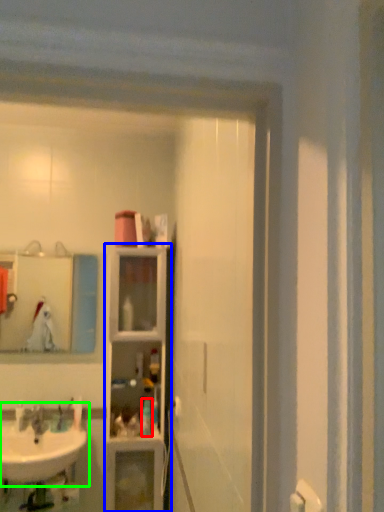
Question: Based on their relative distances, which object is nearer to toiletry (highlighted by a red box)? Choose from closet (highlighted by a blue box) and sink (highlighted by a green box).

Choices:
 (A) closet
 (B) sink

Answer: (A)